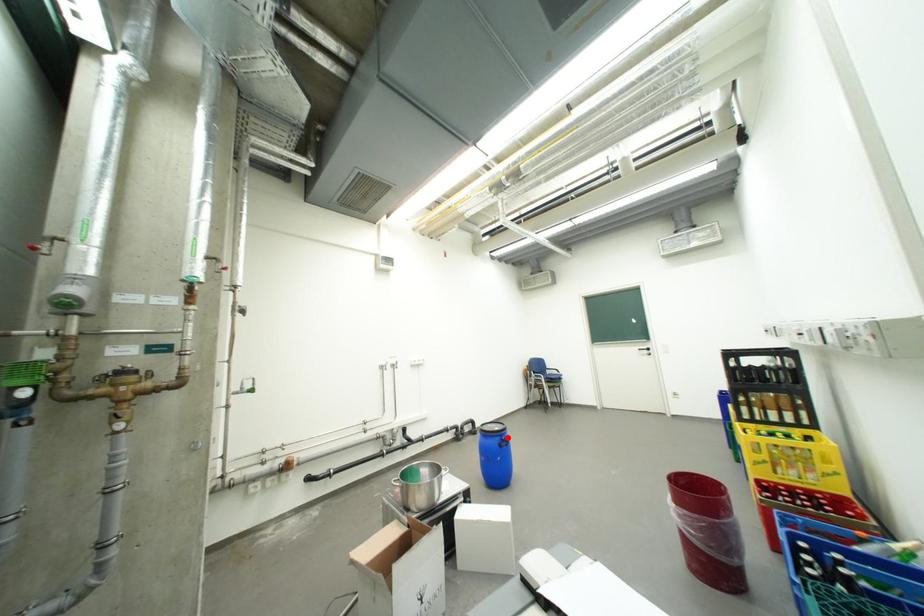
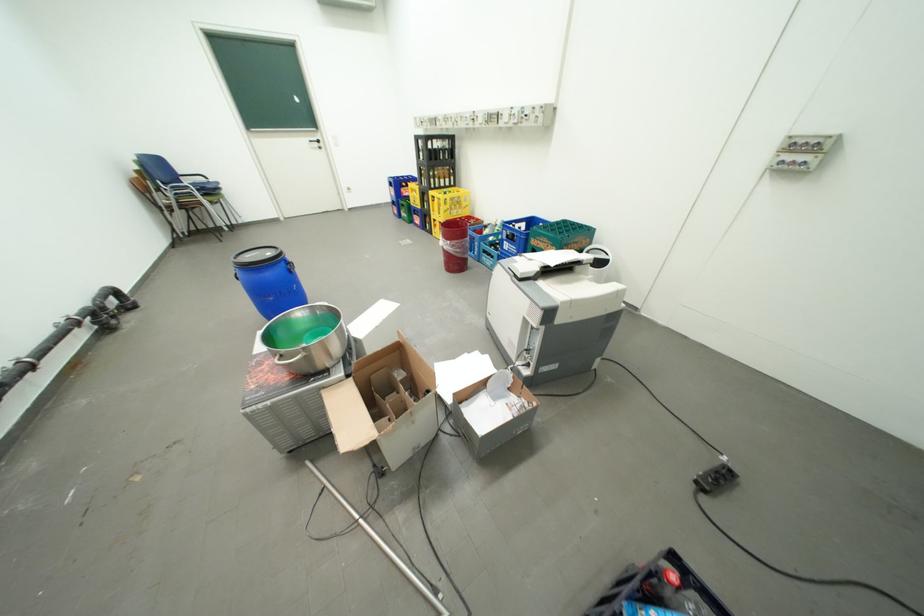
Question: I am providing you with two images of the same scene from different viewpoints. Given a red point in image1, look at the same physical point in image2. Is it:

Choices:
 (A) Closer to the viewpoint
 (B) Farther from the viewpoint

Answer: (A)